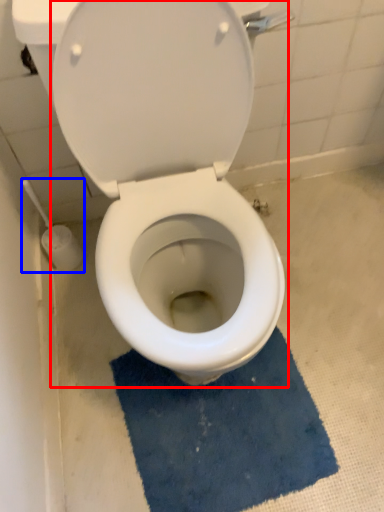
Question: Which object appears farthest to the camera in this image, toilet (highlighted by a red box) or brush (highlighted by a blue box)?

Choices:
 (A) toilet
 (B) brush

Answer: (B)